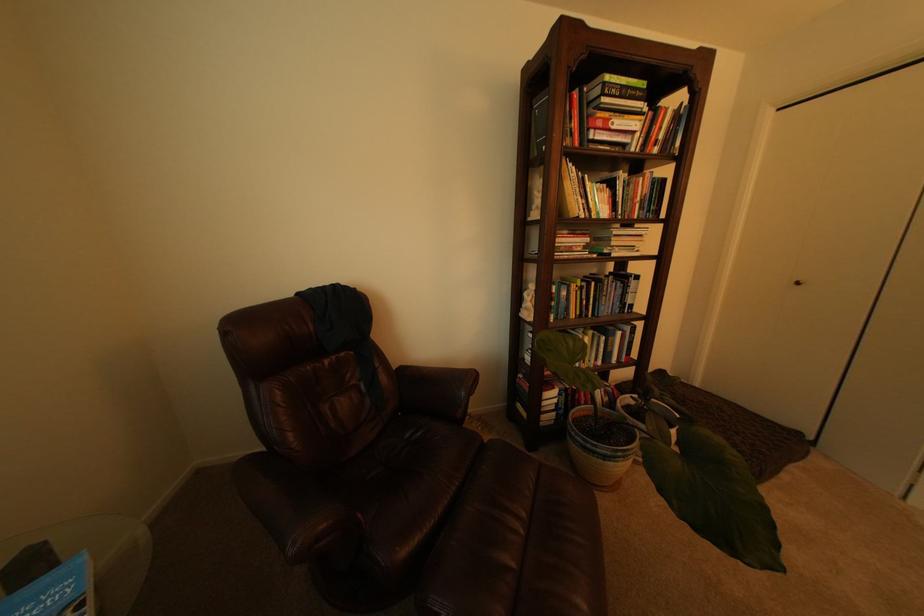
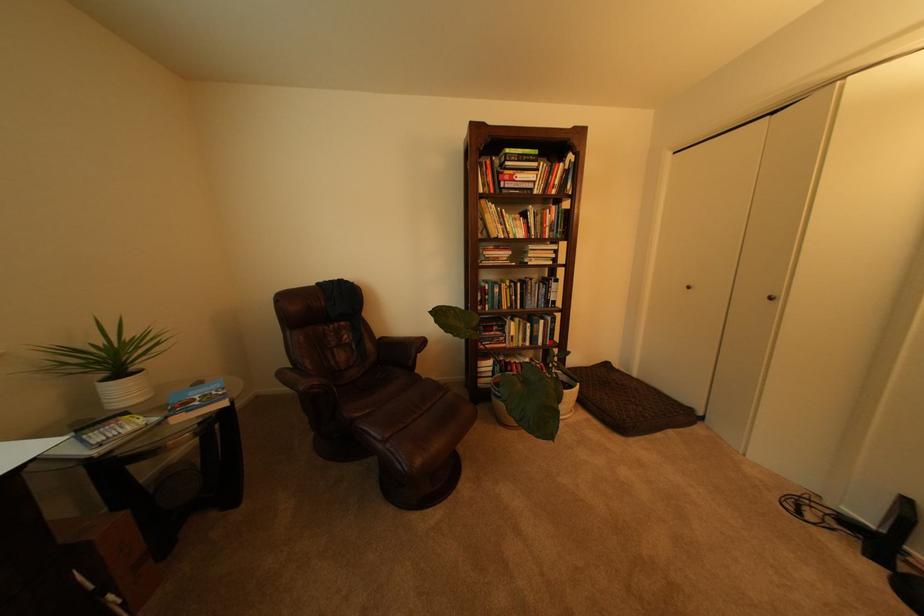
The point at (619,291) is marked in the first image. Where is the corresponding point in the second image?

(543, 290)